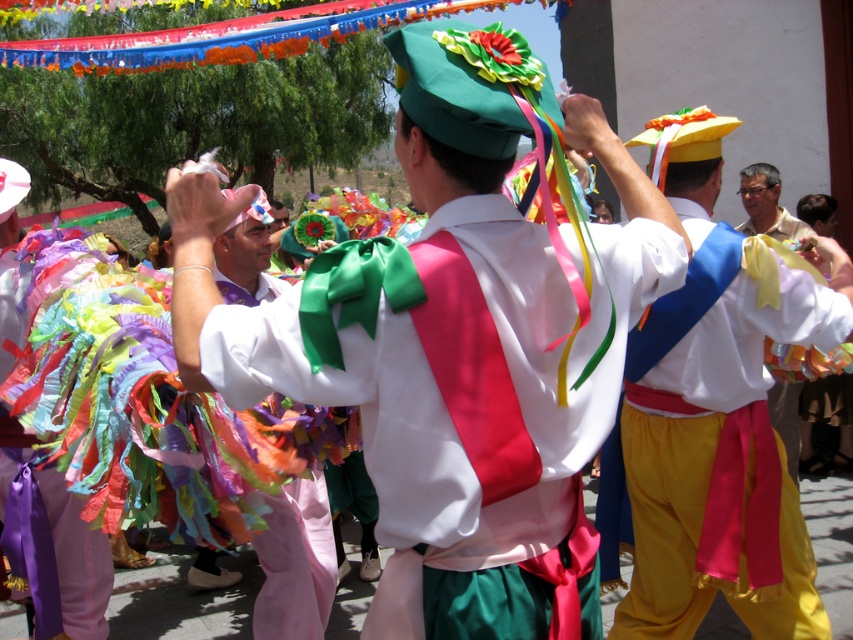
Question: In this image, where is multicolored ribbons at center located relative to matte yellow shirt at right?

Choices:
 (A) below
 (B) above

Answer: (A)

Question: Does matte pink pants at center appear on the right side of multicolored ribbons at center?

Choices:
 (A) yes
 (B) no

Answer: (A)

Question: Which of these objects is positioned farthest from the matte pink pants at center?

Choices:
 (A) matte yellow shirt at right
 (B) multicolored ribbons at center
 (C) silky white blouse at center

Answer: (A)

Question: Which of these objects is positioned farthest from the multicolored fabric ribbons at center?

Choices:
 (A) silky white blouse at center
 (B) matte yellow shirt at right
 (C) matte pink pants at center
 (D) yellow satin pants at right

Answer: (B)

Question: Can you confirm if multicolored fabric ribbons at center is thinner than multicolored ribbons at center?

Choices:
 (A) yes
 (B) no

Answer: (B)

Question: Which object is farther from the camera taking this photo?

Choices:
 (A) multicolored fabric ribbons at center
 (B) multicolored ribbons at center
 (C) matte yellow shirt at right

Answer: (C)